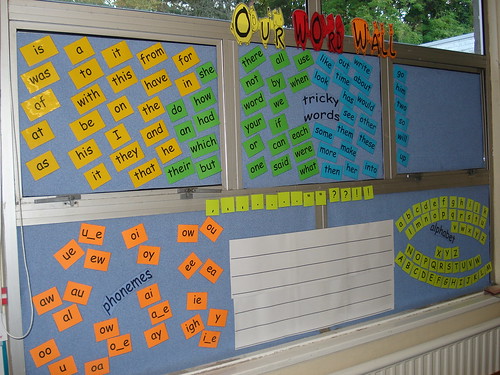
Where is `window frame`? The height and width of the screenshot is (375, 500). window frame is located at coordinates (431, 55).